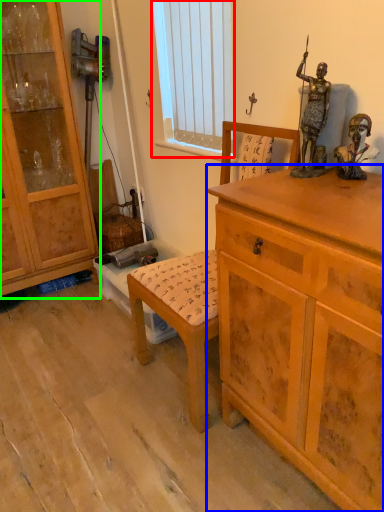
Question: Considering the real-world distances, which object is farthest from window screen (highlighted by a red box)? chest of drawers (highlighted by a blue box) or cabinetry (highlighted by a green box)?

Choices:
 (A) chest of drawers
 (B) cabinetry

Answer: (A)